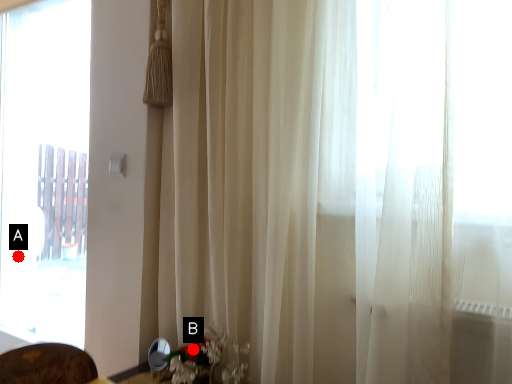
Question: Two points are circled on the image, labeled by A and B beside each circle. Which of the following is the farthest from the observer?

Choices:
 (A) A is further
 (B) B is further

Answer: (A)